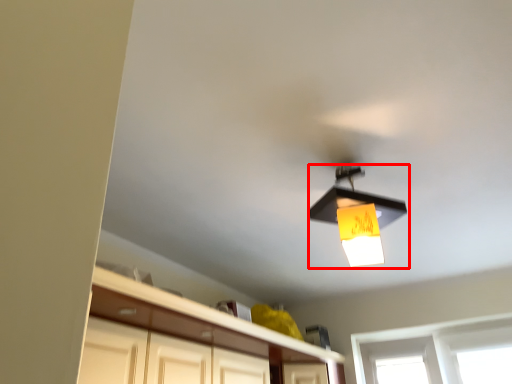
Question: From the image's perspective, where is lamp (annotated by the red box) located relative to cabinetry?

Choices:
 (A) below
 (B) above

Answer: (B)